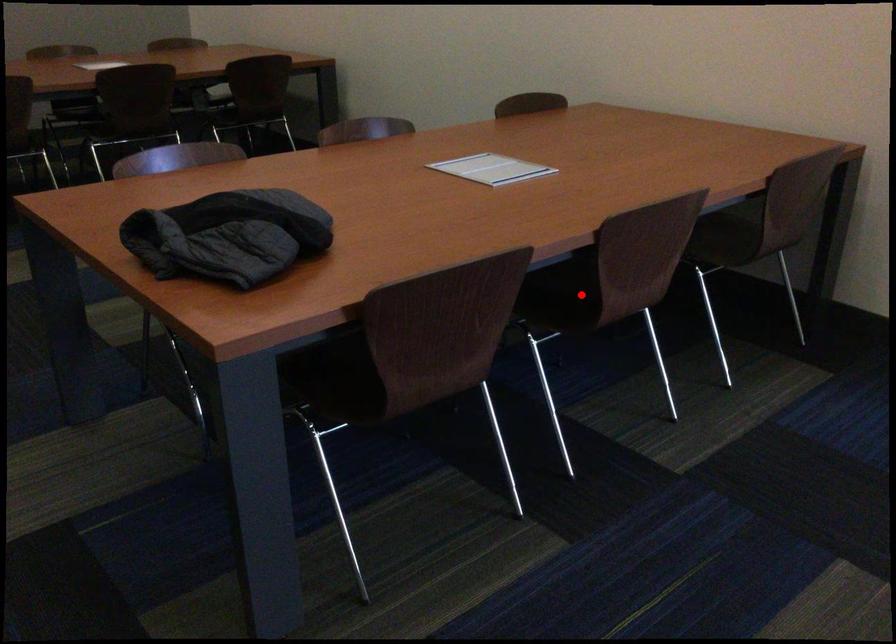
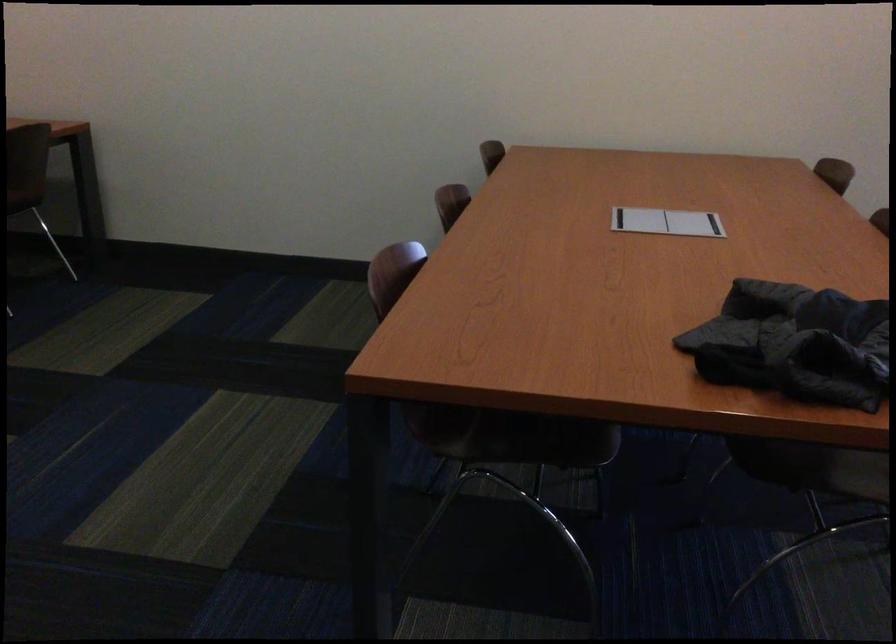
Question: I am providing you with two images of the same scene from different viewpoints. A red point is marked on the first image. Is the red point's position out of view in image 2?

Choices:
 (A) Yes
 (B) No

Answer: (A)